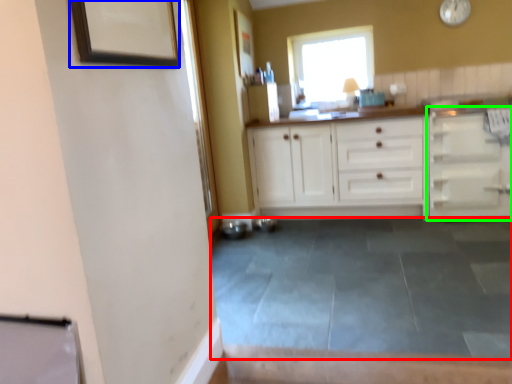
Question: Which object is positioned closest to concrete (highlighted by a red box)? Select from picture frame (highlighted by a blue box) and cabinetry (highlighted by a green box).

Choices:
 (A) picture frame
 (B) cabinetry

Answer: (B)